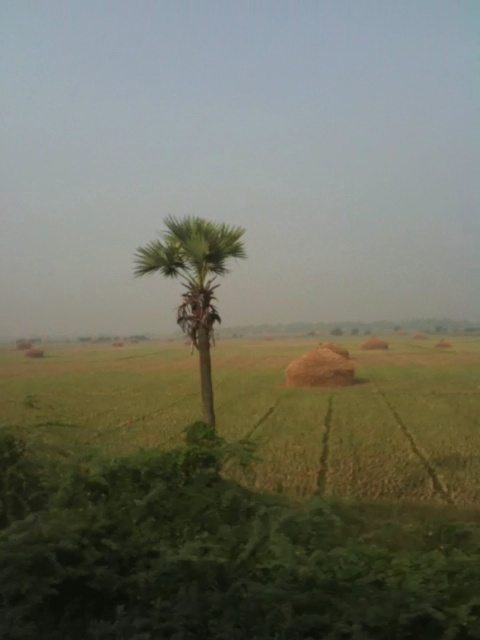
Who is lower down, green leafy vegetation at lower center or green grassy field at center?

green grassy field at center

Between point (396, 582) and point (280, 412), which one is positioned in front?

Positioned in front is point (396, 582).

The image size is (480, 640). Identify the location of green leafy vegetation at lower center. (216, 554).

Is green leafy vegetation at lower center to the right of green leafy palm at center from the viewer's perspective?

Indeed, green leafy vegetation at lower center is positioned on the right side of green leafy palm at center.

Is point (227, 541) positioned after point (203, 397)?

No, (227, 541) is closer to viewer.

Is point (376, 620) less distant than point (197, 237)?

Yes, point (376, 620) is closer to viewer.

Image resolution: width=480 pixels, height=640 pixels. What are the coordinates of `green leafy vegetation at lower center` in the screenshot? It's located at (216, 554).

Can you confirm if green grassy field at center is positioned to the left of green leafy palm at center?

Incorrect, green grassy field at center is not on the left side of green leafy palm at center.

Does green grassy field at center have a larger size compared to green leafy palm at center?

Indeed, green grassy field at center has a larger size compared to green leafy palm at center.

Is point (294, 474) behind point (187, 237)?

Yes, point (294, 474) is farther from viewer.

This screenshot has height=640, width=480. I want to click on green grassy field at center, so click(x=358, y=420).